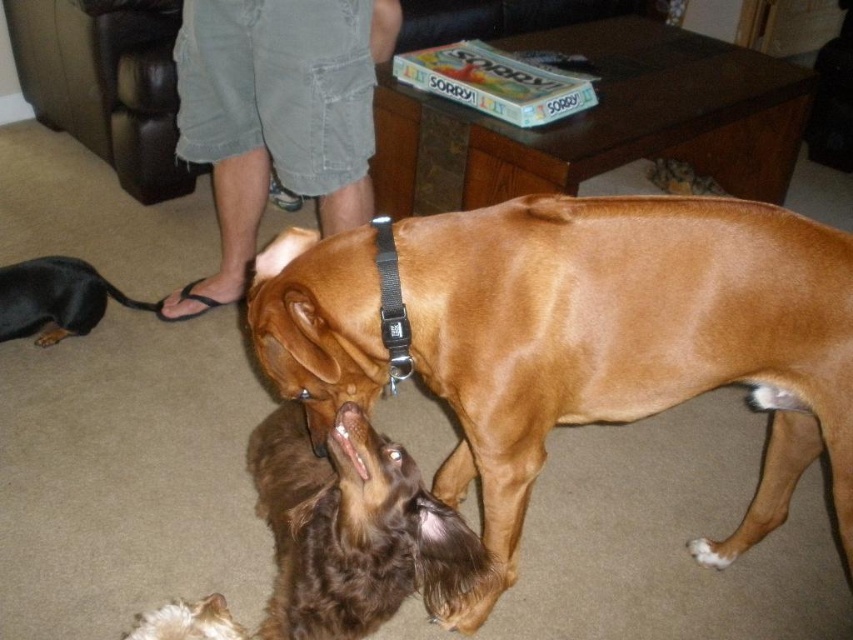
Question: Is brown shiny dog at center to the right of black leather leash at lower left from the viewer's perspective?

Choices:
 (A) yes
 (B) no

Answer: (A)

Question: Which object appears closest to the camera in this image?

Choices:
 (A) brown silky dog at center
 (B) fluffy white dog at lower left
 (C) black leather leash at lower left
 (D) gray cotton shorts at lower center

Answer: (B)

Question: Can you confirm if brown silky dog at center is smaller than black leather leash at lower left?

Choices:
 (A) no
 (B) yes

Answer: (A)

Question: Which object is positioned closest to the brown silky dog at center?

Choices:
 (A) brown shiny dog at center
 (B) black leather leash at lower left
 (C) gray cotton shorts at lower center

Answer: (A)

Question: Which object is the closest to the black leather leash at lower left?

Choices:
 (A) brown silky dog at center
 (B) gray cotton shorts at lower center
 (C) fluffy white dog at lower left
 (D) brown shiny dog at center

Answer: (B)

Question: Can you confirm if gray cotton shorts at lower center is bigger than brown silky dog at center?

Choices:
 (A) no
 (B) yes

Answer: (B)